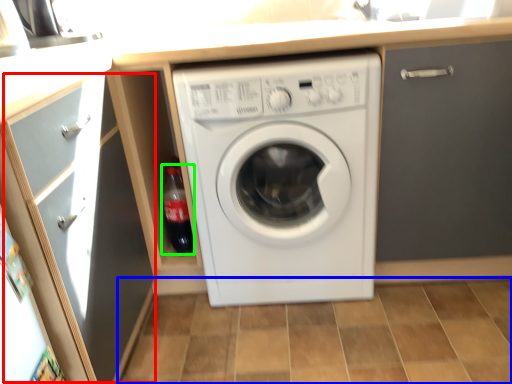
Question: Considering the real-world distances, which object is closest to glass door (highlighted by a red box)? tile (highlighted by a blue box) or bottle (highlighted by a green box).

Choices:
 (A) tile
 (B) bottle

Answer: (B)